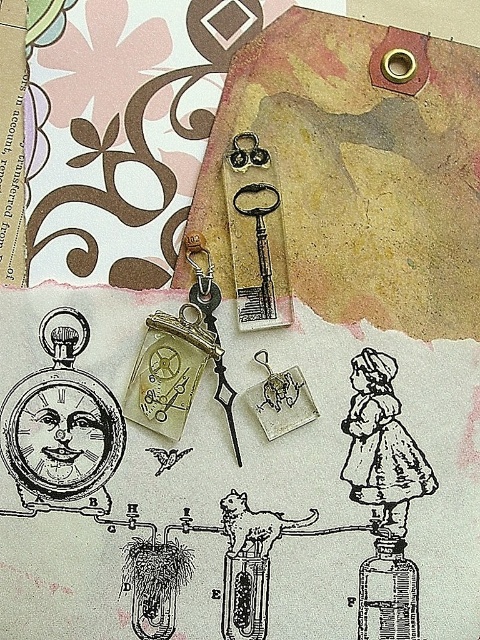
Question: From the image, what is the correct spatial relationship of silver metallic pocket watch at lower left in relation to matte glass bottle at center?

Choices:
 (A) below
 (B) above

Answer: (B)

Question: Can you confirm if silver metallic pocket watch at lower left is wider than matte glass bottle at center?

Choices:
 (A) yes
 (B) no

Answer: (A)

Question: Is silver metallic pocket watch at lower left closer to the viewer compared to matte glass bottle at center?

Choices:
 (A) no
 (B) yes

Answer: (A)

Question: Which of the following is the closest to the observer?

Choices:
 (A) (405, 600)
 (B) (93, 506)

Answer: (A)